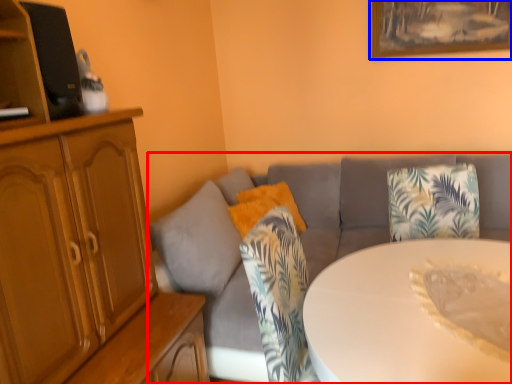
Question: Among these objects, which one is nearest to the camera, studio couch (highlighted by a red box) or picture frame (highlighted by a blue box)?

Choices:
 (A) studio couch
 (B) picture frame

Answer: (A)